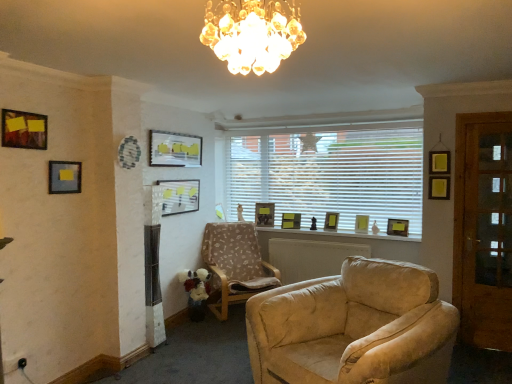
Describe the element at coordinates (331, 220) in the screenshot. This screenshot has width=512, height=384. I see `matte gold picture frame at center, the 3th picture frame when ordered from right to left` at that location.

Measure the distance between point (407, 234) and camera.

Point (407, 234) is 4.64 meters away from camera.

This screenshot has height=384, width=512. Identify the location of matte black picture frame at center, the fourth picture frame from the front. (180, 196).

Describe the element at coordinates (362, 223) in the screenshot. I see `matte gold picture frame at right, which is the 4th picture frame in back-to-front order` at that location.

This screenshot has height=384, width=512. I want to click on matte black picture frame at left, placed as the 8th picture frame when sorted from right to left, so click(x=64, y=177).

Find the location of a particular element. white blinds at center is located at coordinates (329, 171).

In the image, there is a matte gold picture frame at right, the eighth picture frame positioned from the left. At what (x,y) coordinates should I click in order to perform the action: click on glass door above it (from the image's perspective). Please return your answer as a coordinate pair (x, y). Image resolution: width=512 pixels, height=384 pixels. Looking at the image, I should click on (483, 229).

From the image's perspective, is matte gold picture frame at right, which is the 4th picture frame in back-to-front order, above or below wooden glass door at right?

Clearly, from the image's perspective, matte gold picture frame at right, which is the 4th picture frame in back-to-front order, is below wooden glass door at right.

Considering the relative sizes of matte gold picture frame at right, which is the 4th picture frame in back-to-front order, and wooden glass door at right in the image provided, is matte gold picture frame at right, which is the 4th picture frame in back-to-front order, taller than wooden glass door at right?

No, matte gold picture frame at right, which is the 4th picture frame in back-to-front order, is not taller than wooden glass door at right.

Looking at their sizes, would you say matte gold picture frame at right, which is the 4th picture frame in back-to-front order, is wider or thinner than wooden glass door at right?

matte gold picture frame at right, which is the 4th picture frame in back-to-front order, is wider than wooden glass door at right.

Does patterned fabric armchair at center touch matte black picture frame at left, the 8th picture frame positioned from the back?

patterned fabric armchair at center and matte black picture frame at left, the 8th picture frame positioned from the back, are clearly separated.

Which object is closer to the camera taking this photo, patterned fabric armchair at center or matte black picture frame at left, placed as the 2th picture frame when sorted from left to right?

matte black picture frame at left, placed as the 2th picture frame when sorted from left to right, is in front.

Could you tell me if patterned fabric armchair at center is facing matte black picture frame at left, placed as the 2th picture frame when sorted from left to right?

No, patterned fabric armchair at center is not turned towards matte black picture frame at left, placed as the 2th picture frame when sorted from left to right.

Image resolution: width=512 pixels, height=384 pixels. I want to click on chair behind the matte black picture frame at left, placed as the 8th picture frame when sorted from right to left, so click(x=236, y=264).

Where is `lamp that appears in front of the wooden picture frame at window, which is the 9th picture frame from left to right`? lamp that appears in front of the wooden picture frame at window, which is the 9th picture frame from left to right is located at coordinates (252, 33).

Is crystal glass chandelier at upper center at the right side of wooden picture frame at window, the fifth picture frame in the back-to-front sequence?

→ No, crystal glass chandelier at upper center is not to the right of wooden picture frame at window, the fifth picture frame in the back-to-front sequence.

Who is bigger, crystal glass chandelier at upper center or wooden picture frame at window, the fifth picture frame in the back-to-front sequence?

crystal glass chandelier at upper center.

Considering the sizes of objects matte gold picture frame at center, the 3th picture frame when ordered from right to left, and white blinds at center in the image provided, who is thinner, matte gold picture frame at center, the 3th picture frame when ordered from right to left, or white blinds at center?

With smaller width is white blinds at center.

Looking at this image, from the image's perspective, which one is positioned higher, matte gold picture frame at center, the 3th picture frame when ordered from right to left, or white blinds at center?

white blinds at center, from the image's perspective.

Does matte gold picture frame at center, which is the third picture frame from back to front, lie in front of white blinds at center?

No, the depth of matte gold picture frame at center, which is the third picture frame from back to front, is greater than that of white blinds at center.

From the image's perspective, is matte green picture frame at center, acting as the 2th picture frame starting from the back, beneath patterned fabric armchair at center?

Incorrect, from the image's perspective, matte green picture frame at center, acting as the 2th picture frame starting from the back, is higher than patterned fabric armchair at center.

From a real-world perspective, is matte green picture frame at center, the 6th picture frame in the left-to-right sequence, positioned over patterned fabric armchair at center based on gravity?

Yes, from a real-world perspective, matte green picture frame at center, the 6th picture frame in the left-to-right sequence, is above patterned fabric armchair at center.

Is matte green picture frame at center, which ranks as the fourth picture frame in right-to-left order, far from patterned fabric armchair at center?

matte green picture frame at center, which ranks as the fourth picture frame in right-to-left order, is near patterned fabric armchair at center, not far away.

Looking at this image, is matte green picture frame at center, which ranks as the fourth picture frame in right-to-left order, wider than patterned fabric armchair at center?

No, matte green picture frame at center, which ranks as the fourth picture frame in right-to-left order, is not wider than patterned fabric armchair at center.

Based on the photo, can we say matte green picture frame at center, which ranks as the fourth picture frame in right-to-left order, lies outside crystal glass chandelier at upper center?

Yes, matte green picture frame at center, which ranks as the fourth picture frame in right-to-left order, is not within crystal glass chandelier at upper center.

What's the angular difference between matte green picture frame at center, acting as the 2th picture frame starting from the back, and crystal glass chandelier at upper center's facing directions?

3.2 degrees.

Between matte green picture frame at center, the eighth picture frame viewed from the front, and crystal glass chandelier at upper center, which one has larger width?

crystal glass chandelier at upper center is wider.

Considering the positions of objects matte green picture frame at center, the 6th picture frame in the left-to-right sequence, and crystal glass chandelier at upper center in the image provided, who is more to the right, matte green picture frame at center, the 6th picture frame in the left-to-right sequence, or crystal glass chandelier at upper center?

From the viewer's perspective, matte green picture frame at center, the 6th picture frame in the left-to-right sequence, appears more on the right side.

From a real-world perspective, which is physically above, white blinds at center or wooden glass door at right?

white blinds at center.

Find the location of a particular element. glass door that is on the right side of white blinds at center is located at coordinates (483, 229).

What's the angular difference between white blinds at center and wooden glass door at right's facing directions?

white blinds at center and wooden glass door at right are facing 1.76 degrees away from each other.

Is white blinds at center positioned with its back to wooden glass door at right?

white blinds at center does not have its back to wooden glass door at right.

I want to click on glass door in front of the matte gold picture frame at right, which ranks as the 6th picture frame in front-to-back order, so click(483, 229).

Where is `chair on the right of matte black picture frame at left, placed as the 8th picture frame when sorted from right to left`? chair on the right of matte black picture frame at left, placed as the 8th picture frame when sorted from right to left is located at coordinates (236, 264).

Which object lies further to the anchor point matte glass picture frame at upper center, which is counted as the seventh picture frame, starting from the right, patterned fabric armchair at center or matte green picture frame at center, the 6th picture frame in the left-to-right sequence?

Among the two, matte green picture frame at center, the 6th picture frame in the left-to-right sequence, is located further to matte glass picture frame at upper center, which is counted as the seventh picture frame, starting from the right.

Considering their positions, is matte green picture frame at center, acting as the 2th picture frame starting from the back, positioned closer to wooden glass door at right than matte wooden picture frame at upper left, the ninth picture frame from the back?

matte green picture frame at center, acting as the 2th picture frame starting from the back, lies closer to wooden glass door at right than the other object.

Based on their spatial positions, is wooden glass door at right or matte green picture frame at center, which ranks as the fourth picture frame in right-to-left order, closer to matte black picture frame at center, the fourth picture frame from the front?

Among the two, matte green picture frame at center, which ranks as the fourth picture frame in right-to-left order, is located nearer to matte black picture frame at center, the fourth picture frame from the front.

Considering their positions, is matte gold picture frame at center, the 3th picture frame when ordered from right to left, positioned further to matte gold picture frame at center, acting as the first picture frame starting from the back, than matte gold picture frame at right, the eighth picture frame positioned from the left?

matte gold picture frame at right, the eighth picture frame positioned from the left, is positioned further to the anchor matte gold picture frame at center, acting as the first picture frame starting from the back.

Estimate the real-world distances between objects in this image. Which object is further from matte gold picture frame at right, the eighth picture frame positioned from the left, matte gold picture frame at center, which is the ninth picture frame from front to back, or crystal glass chandelier at upper center?

crystal glass chandelier at upper center.

Estimate the real-world distances between objects in this image. Which object is closer to matte black picture frame at left, placed as the 2th picture frame when sorted from left to right, matte gold picture frame at right, which is the 4th picture frame in back-to-front order, or wooden glass door at right?

The object closer to matte black picture frame at left, placed as the 2th picture frame when sorted from left to right, is matte gold picture frame at right, which is the 4th picture frame in back-to-front order.

Estimate the real-world distances between objects in this image. Which object is closer to matte black picture frame at center, acting as the 4th picture frame starting from the left, white blinds at center or matte green picture frame at center, the eighth picture frame viewed from the front?

Based on the image, matte green picture frame at center, the eighth picture frame viewed from the front, appears to be nearer to matte black picture frame at center, acting as the 4th picture frame starting from the left.

When comparing their distances from patterned fabric armchair at center, does wooden glass door at right or matte gold picture frame at center, which is the seventh picture frame in front-to-back order, seem further?

The object further to patterned fabric armchair at center is wooden glass door at right.

This screenshot has width=512, height=384. I want to click on chair between crystal glass chandelier at upper center and matte gold picture frame at center, the fifth picture frame when ordered from left to right, in the front-back direction, so [x=236, y=264].

Locate an element on the screen. picture frame between matte wooden picture frame at upper left, acting as the 1th picture frame starting from the front, and matte glass picture frame at upper center, marked as the third picture frame in a left-to-right arrangement, along the z-axis is located at coordinates (64, 177).

This screenshot has height=384, width=512. I want to click on chair positioned between matte black picture frame at center, positioned as the 6th picture frame in right-to-left order, and matte gold picture frame at center, which is the ninth picture frame from front to back, from near to far, so click(x=236, y=264).

This screenshot has width=512, height=384. In order to click on window between matte gold picture frame at center, which is the ninth picture frame from front to back, and matte gold picture frame at center, the 3th picture frame when ordered from right to left in this screenshot , I will do `click(329, 171)`.